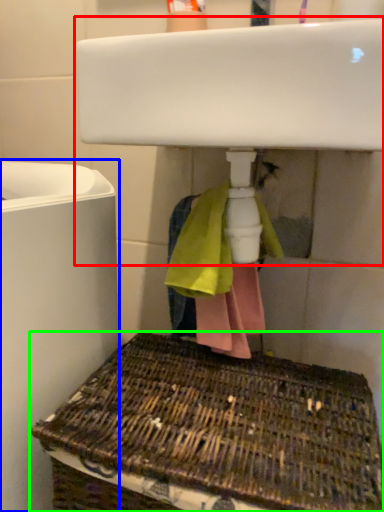
Question: Which object is the farthest from sink (highlighted by a red box)? Choose among these: appliance (highlighted by a blue box) or basket (highlighted by a green box).

Choices:
 (A) appliance
 (B) basket

Answer: (B)